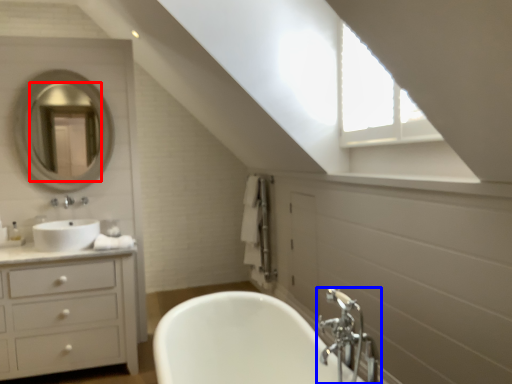
Question: Among these objects, which one is farthest to the camera, mirror (highlighted by a red box) or tap (highlighted by a blue box)?

Choices:
 (A) mirror
 (B) tap

Answer: (A)